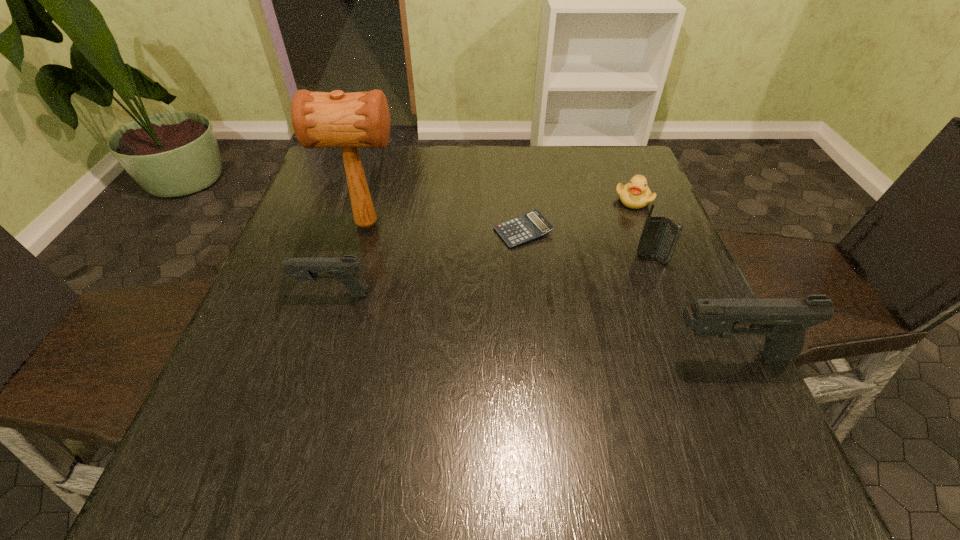
This screenshot has height=540, width=960. Identify the location of pistol at the right edge. (783, 321).

This screenshot has width=960, height=540. I want to click on cellular telephone located in the right edge section of the desktop, so click(x=659, y=236).

Where is `duckling that is at the right edge`? The image size is (960, 540). duckling that is at the right edge is located at coordinates (636, 194).

At what (x,y) coordinates should I click in order to perform the action: click on object that is at the far right corner. Please return your answer as a coordinate pair (x, y). The image size is (960, 540). Looking at the image, I should click on (636, 194).

The image size is (960, 540). In the image, there is a desktop. Find the location of `vacant space at the far edge`. vacant space at the far edge is located at coordinates pos(496,172).

Locate an element on the screen. The height and width of the screenshot is (540, 960). vacant space at the near edge of the desktop is located at coordinates (590, 398).

I want to click on vacant space at the left edge of the desktop, so click(341, 244).

Locate an element on the screen. This screenshot has height=540, width=960. vacant space at the right edge of the desktop is located at coordinates (676, 268).

This screenshot has height=540, width=960. In the image, there is a desktop. What are the coordinates of `vacant space at the far left corner` in the screenshot? It's located at (372, 150).

Locate an element on the screen. This screenshot has height=540, width=960. vacant space at the far right corner of the desktop is located at coordinates (621, 175).